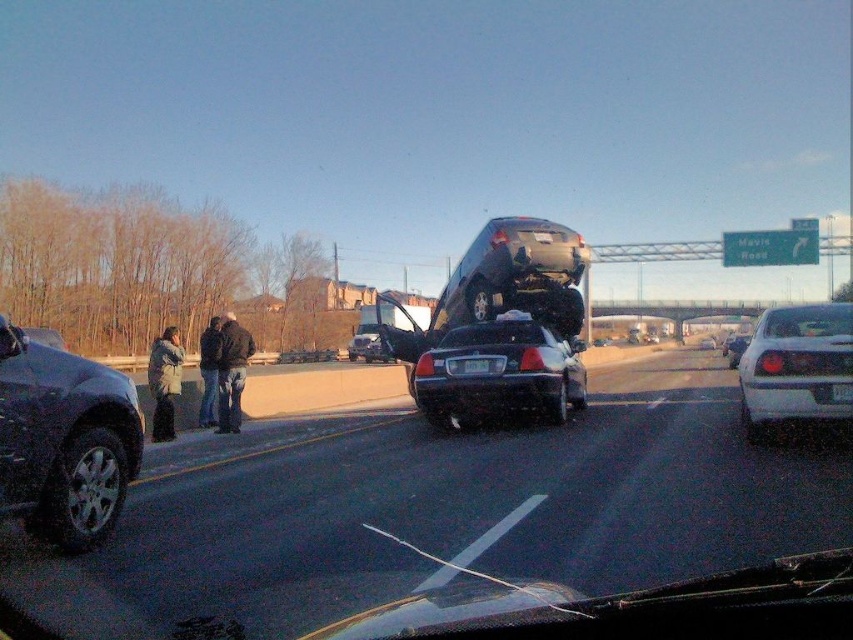
You are a traffic officer assessing the accident scene. You notice a specific point at coordinates (795, 365). Which vehicle is this point located on?

The point at coordinates (795, 365) is located on the white glossy sedan at right.

You are a traffic officer assessing the accident scene. You notice two points marked on the road at coordinates point (827, 317) and point (848, 385). Which point is closer to your current position?

Point (827, 317) is further to the viewer than point (848, 385). Therefore, point (848, 385) is closer to your current position.

You are a traffic officer assessing the accident scene. You notice the shiny black car at center and the dark blue jeans at center. Which object is nearer to your current position?

The shiny black car at center is closer to the viewer than the dark blue jeans at center, so the shiny black car at center is nearer to your current position.